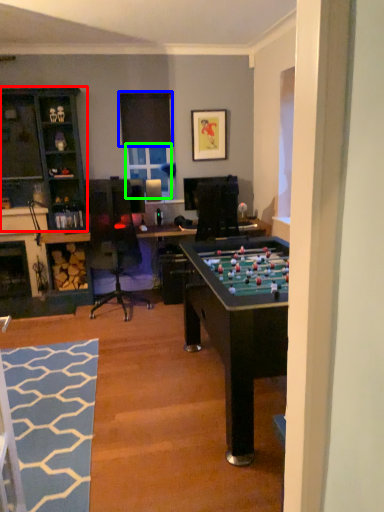
Question: Which object is positioned farthest from cabinetry (highlighted by a red box)? Select from window screen (highlighted by a blue box) and window screen (highlighted by a green box).

Choices:
 (A) window screen
 (B) window screen

Answer: (B)